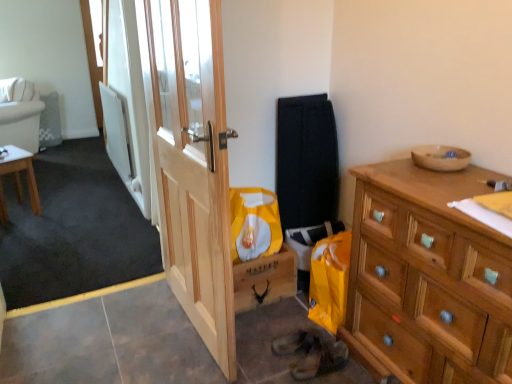
Locate an element on the screen. The width and height of the screenshot is (512, 384). free region on the left part of natural wood door at center is located at coordinates (111, 331).